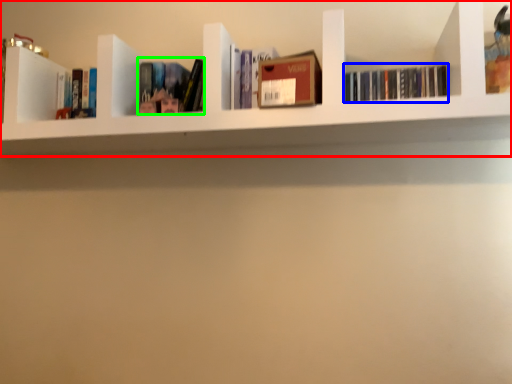
Question: Which is farther away from shelf (highlighted by a red box)? book (highlighted by a blue box) or book (highlighted by a green box)?

Choices:
 (A) book
 (B) book

Answer: (A)